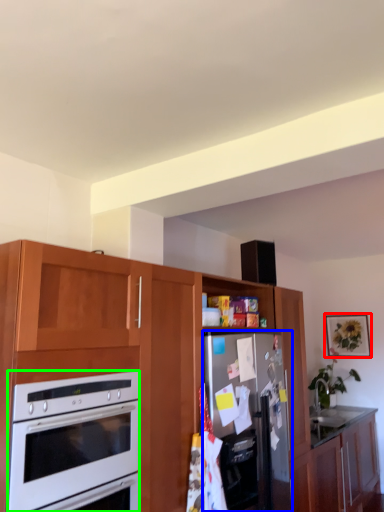
Question: Which is nearer to the picture frame (highlighted by a red box)? refrigerator (highlighted by a blue box) or oven (highlighted by a green box).

Choices:
 (A) refrigerator
 (B) oven

Answer: (A)